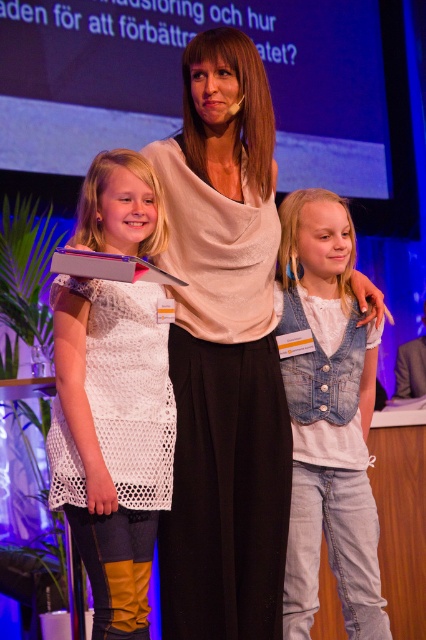
Which is behind, point (270, 364) or point (362, 426)?

Point (362, 426)

Can you confirm if matte white blouse at center is bigger than denim vest at center?

Indeed, matte white blouse at center has a larger size compared to denim vest at center.

Image resolution: width=426 pixels, height=640 pixels. What are the coordinates of `matte white blouse at center` in the screenshot? It's located at (224, 353).

Is matte white blouse at center below white crochet dress at center?

No, matte white blouse at center is not below white crochet dress at center.

Is point (229, 45) farther from camera compared to point (98, 593)?

That is True.

Is point (218, 513) positioned in front of point (141, 570)?

No, it is not.

Where is `matte white blouse at center`? Image resolution: width=426 pixels, height=640 pixels. matte white blouse at center is located at coordinates (224, 353).

Is point (135, 529) farther from camera compared to point (331, 554)?

No, (135, 529) is in front of (331, 554).

Is point (91, 544) more distant than point (298, 280)?

That is False.

At what (x,y) coordinates should I click in order to perform the action: click on white crochet dress at center. Please return your answer as a coordinate pair (x, y). Looking at the image, I should click on (112, 440).